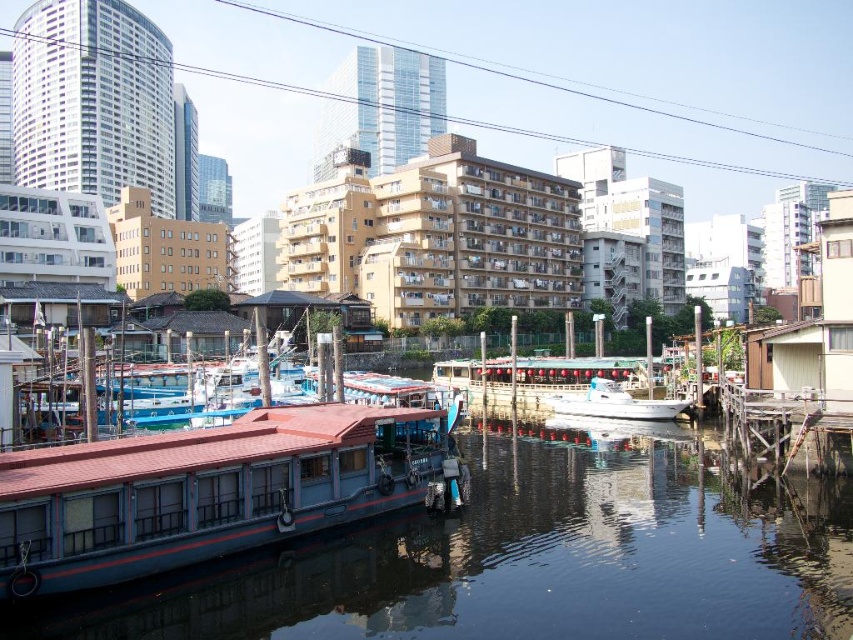
Question: Can you confirm if blue painted wood boat at lower left is positioned to the right of white glossy boat at center?

Choices:
 (A) no
 (B) yes

Answer: (A)

Question: Which object is closer to the camera taking this photo?

Choices:
 (A) blue painted wood boat at lower left
 (B) white glossy boat at center

Answer: (A)

Question: Which point is closer to the camera?

Choices:
 (A) white glossy boat at center
 (B) blue painted wood boat at lower left
 (C) blue wooden boat at lower left

Answer: (C)

Question: Which point is closer to the camera taking this photo?

Choices:
 (A) click(296, 554)
 (B) click(554, 408)

Answer: (A)

Question: Observing the image, what is the correct spatial positioning of blue painted wood boat at lower left in reference to white glossy boat at center?

Choices:
 (A) right
 (B) left

Answer: (B)

Question: Is blue painted wood boat at lower left to the left of white glossy boat at center from the viewer's perspective?

Choices:
 (A) yes
 (B) no

Answer: (A)